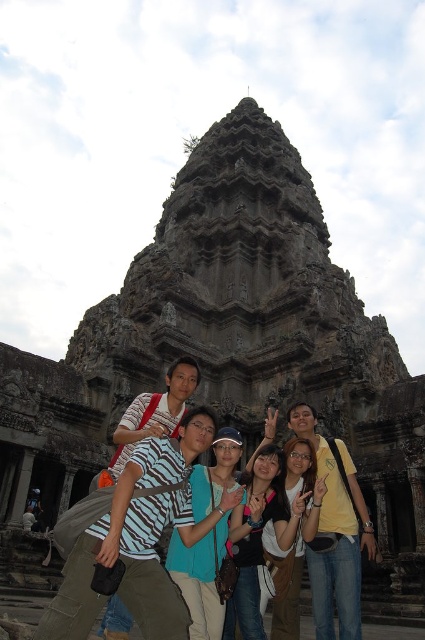
Who is lower down, teal fabric shirt at center or matte black shirt at center?

matte black shirt at center is below.

Can you confirm if teal fabric shirt at center is positioned to the left of matte black shirt at center?

Yes, teal fabric shirt at center is to the left of matte black shirt at center.

Is point (212, 444) farther from camera compared to point (300, 556)?

That is True.

Identify the location of teal fabric shirt at center. (206, 536).

Does zebra-patterned shirt at center have a lesser height compared to teal fabric shirt at center?

Correct, zebra-patterned shirt at center is not as tall as teal fabric shirt at center.

Describe the element at coordinates (138, 540) in the screenshot. I see `zebra-patterned shirt at center` at that location.

The image size is (425, 640). Find the location of `zebra-patterned shirt at center`. zebra-patterned shirt at center is located at coordinates (138, 540).

Locate an element on the screen. Image resolution: width=425 pixels, height=640 pixels. zebra-patterned shirt at center is located at coordinates (138, 540).

Measure the distance from zebra-patterned shirt at center to matte black shirt at center.

zebra-patterned shirt at center and matte black shirt at center are 33.72 feet apart.

Looking at this image, who is taller, zebra-patterned shirt at center or matte black shirt at center?

matte black shirt at center

Identify the location of zebra-patterned shirt at center. The height and width of the screenshot is (640, 425). (138, 540).